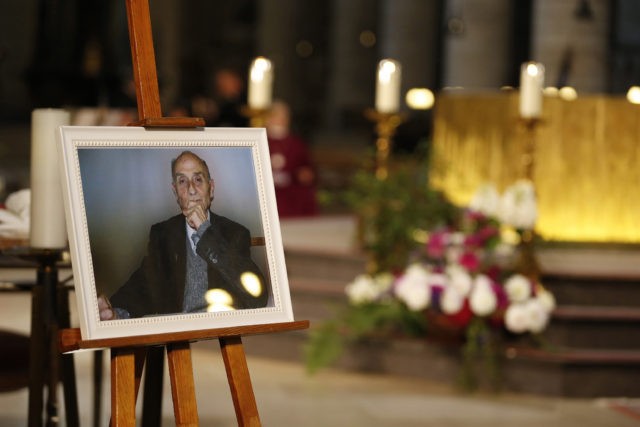
Find the location of `easel`. easel is located at coordinates (180, 372).